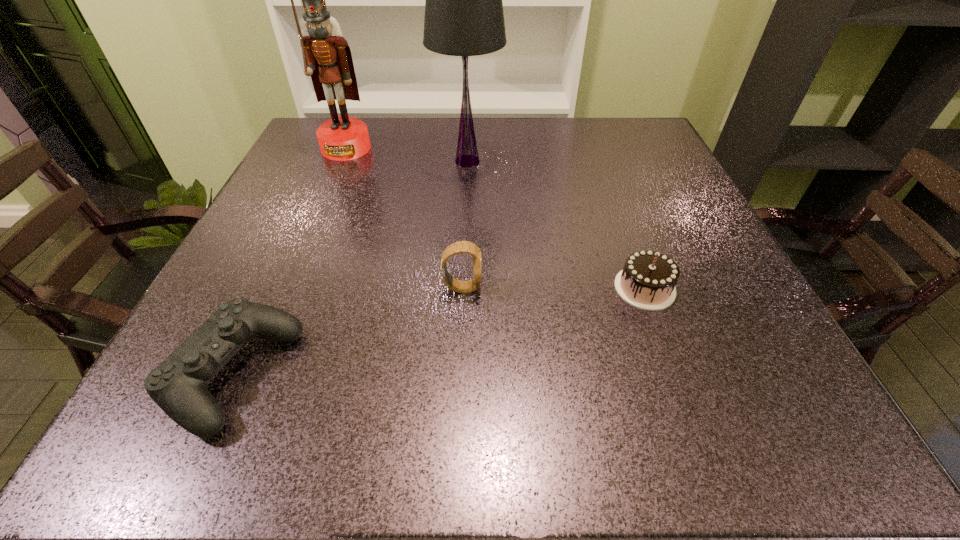
Identify the location of nutcracker that is at the far edge. The width and height of the screenshot is (960, 540). (327, 58).

Where is `lampshade that is at the far edge`? Image resolution: width=960 pixels, height=540 pixels. lampshade that is at the far edge is located at coordinates (464, 16).

At what (x,y) coordinates should I click in order to perform the action: click on object positioned at the near edge. Please return your answer as a coordinate pair (x, y). Image resolution: width=960 pixels, height=540 pixels. Looking at the image, I should click on (178, 385).

The height and width of the screenshot is (540, 960). I want to click on nutcracker that is at the left edge, so click(x=327, y=58).

At what (x,y) coordinates should I click in order to perform the action: click on control at the left edge. Please return your answer as a coordinate pair (x, y). Looking at the image, I should click on (178, 385).

The image size is (960, 540). Identify the location of object located in the right edge section of the desktop. (647, 281).

I want to click on object that is positioned at the far left corner, so click(x=327, y=58).

The height and width of the screenshot is (540, 960). I want to click on object positioned at the near left corner, so click(x=178, y=385).

Identify the location of free space at the far edge of the desktop. Image resolution: width=960 pixels, height=540 pixels. (528, 143).

The width and height of the screenshot is (960, 540). I want to click on blank space at the near edge of the desktop, so click(617, 420).